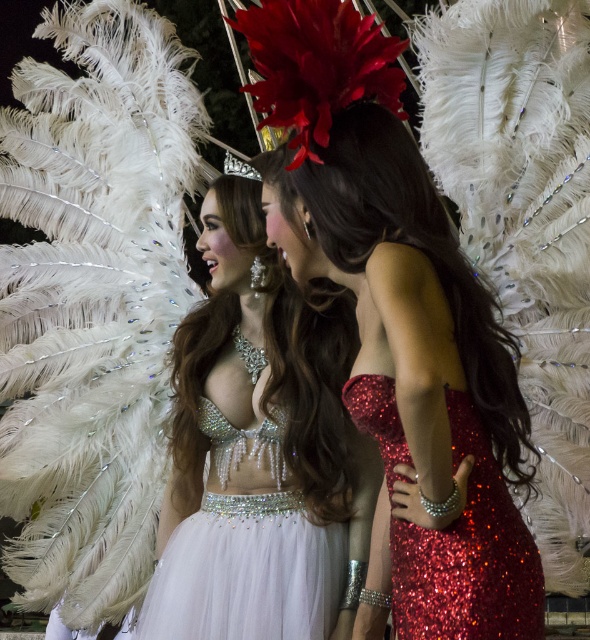
Question: Which point is closer to the camera?

Choices:
 (A) (337, 564)
 (B) (510, 442)
 (C) (422, 538)

Answer: (C)

Question: Which point is closer to the camera?

Choices:
 (A) shiny red dress at center
 (B) swarthy satin dress at center
 (C) sparkly red dress at center

Answer: (C)

Question: Considering the relative positions of shiny red dress at center and sparkly red dress at center in the image provided, where is shiny red dress at center located with respect to sparkly red dress at center?

Choices:
 (A) right
 (B) left

Answer: (B)

Question: Which point is farther to the camera?

Choices:
 (A) (427, 192)
 (B) (296, 337)
 (C) (411, 528)

Answer: (B)

Question: Can you confirm if shiny red dress at center is bigger than sparkly red dress at center?

Choices:
 (A) no
 (B) yes

Answer: (B)

Question: Is shiny red dress at center to the right of sparkly red dress at center from the viewer's perspective?

Choices:
 (A) yes
 (B) no

Answer: (B)